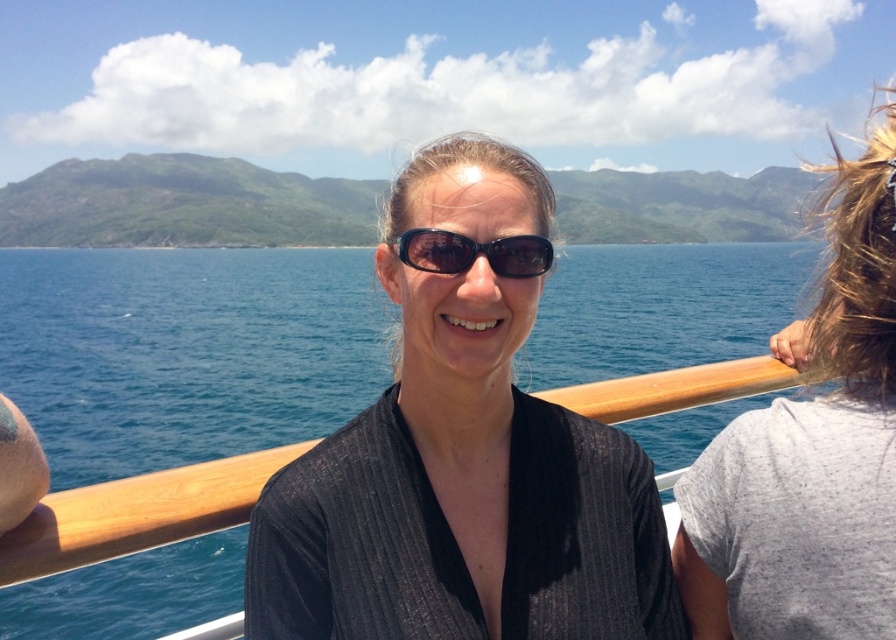
Does blue water at center have a greater height compared to sunglasses at center?

Correct, blue water at center is much taller as sunglasses at center.

In the scene shown: Between blue water at center and sunglasses at center, which one has less height?

Standing shorter between the two is sunglasses at center.

Measure the distance between point (x=616, y=339) and camera.

A distance of 115.50 meters exists between point (x=616, y=339) and camera.

Find the location of a particular element. Image resolution: width=896 pixels, height=640 pixels. blue water at center is located at coordinates (185, 352).

Does black ribbed shirt at center appear under sunglasses at center?

Yes.

Which is below, black ribbed shirt at center or sunglasses at center?

black ribbed shirt at center is below.

The height and width of the screenshot is (640, 896). Describe the element at coordinates (462, 461) in the screenshot. I see `black ribbed shirt at center` at that location.

Find the location of a particular element. Image resolution: width=896 pixels, height=640 pixels. black ribbed shirt at center is located at coordinates (462, 461).

Between blue water at center and gray cotton t-shirt at right, which one is positioned higher?

blue water at center

Is point (625, 312) closer to camera compared to point (868, 307)?

No, (625, 312) is further to viewer.

Find the location of a particular element. blue water at center is located at coordinates (185, 352).